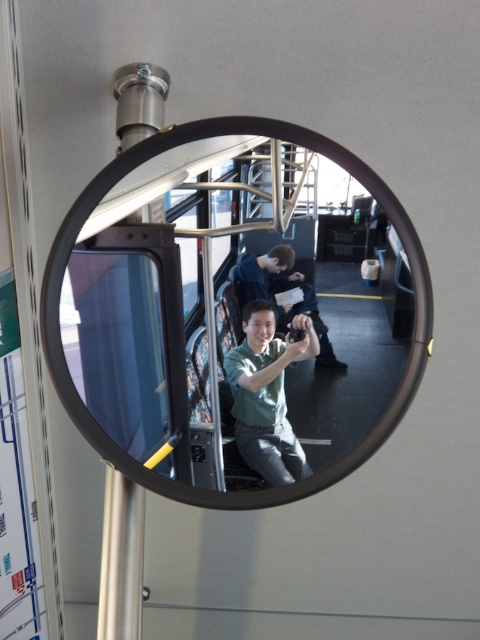
You are a passenger on a bus and you want to take a photo of the black reflective mirror at center. However, there is a person wearing a matte green shirt at center in the way. Can you move around them to get a clear shot of the mirror?

The black reflective mirror at center is in front of the matte green shirt at center, so the person in the matte green shirt at center is blocking the view. You can move to the side to get around them and take the photo without obstruction.

You are a maintenance worker checking the convex security mirror mounted on a metallic pole in a public transportation vehicle. You notice two people in the reflection of the mirror. One is wearing a green matte shirt at center and the other is wearing a matte green shirt at center. The mirror shows their positions relative to each other. Can you determine if the two people are standing next to each other or if there is space between them based on the mirror reflection?

The mirror reflection shows a distance of 2.86 inches between the green matte shirt at center and the matte green shirt at center, indicating there is space between them.

You are a passenger on a bus and see the green matte shirt at center and the matte green shirt at center in the convex security mirror reflection. Which one is positioned lower in the reflection?

The green matte shirt at center is positioned lower in the reflection as it is below the matte green shirt at center.